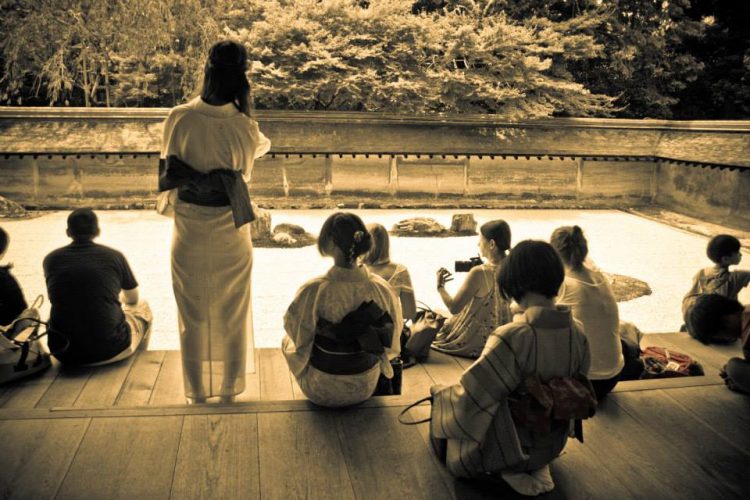
Locate an element on the screen. This screenshot has width=750, height=500. floor is located at coordinates (279, 453).